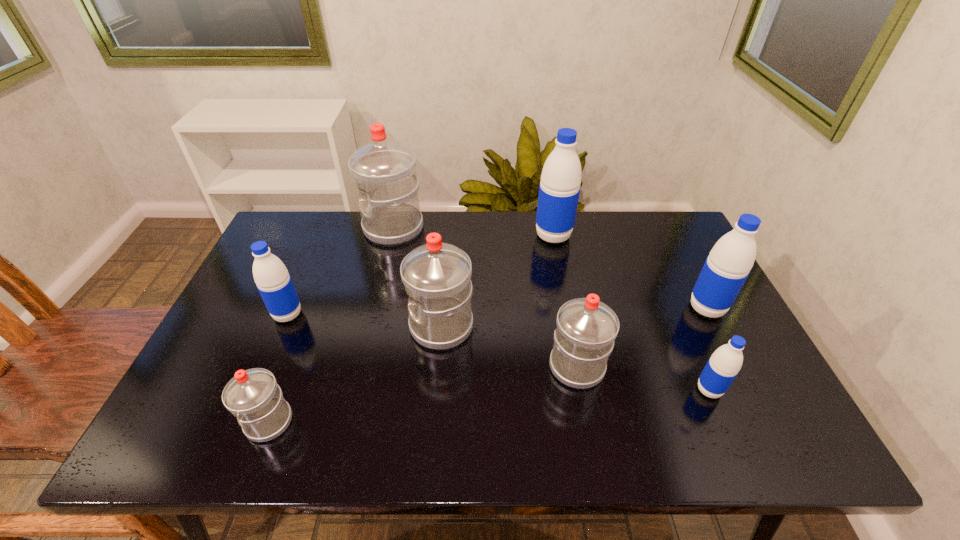
Where is `the biggest blue water bottle`? The width and height of the screenshot is (960, 540). the biggest blue water bottle is located at coordinates (559, 189).

You are a GUI agent. You are given a task and a screenshot of the screen. Output one action in this format:
    pyautogui.click(x=<x>, y=<y>)
    Task: Click on the third blue water bottle from right to left
    Image resolution: width=960 pixels, height=540 pixels.
    Given the screenshot: What is the action you would take?
    pyautogui.click(x=559, y=189)

Locate an element on the screen. The width and height of the screenshot is (960, 540). the third water bottle from left to right is located at coordinates [384, 171].

You are a GUI agent. You are given a task and a screenshot of the screen. Output one action in this format:
    pyautogui.click(x=<x>, y=<y>)
    Task: Click on the farthest white water bottle
    The height and width of the screenshot is (540, 960).
    Given the screenshot: What is the action you would take?
    384,171

Find the location of a particular element. the rightmost water bottle is located at coordinates (728, 265).

Find the location of a particular element. Image resolution: width=960 pixels, height=540 pixels. the rightmost blue water bottle is located at coordinates (728, 265).

Identify the location of the third white water bottle from left to right. Image resolution: width=960 pixels, height=540 pixels. (437, 276).

This screenshot has width=960, height=540. In order to click on the third smallest white water bottle in this screenshot , I will do `click(437, 276)`.

At what (x,y) coordinates should I click in order to perform the action: click on the rightmost white water bottle. Please return your answer as a coordinate pair (x, y). Looking at the image, I should click on (586, 328).

The height and width of the screenshot is (540, 960). In order to click on the leftmost blue water bottle in this screenshot , I will do `click(272, 279)`.